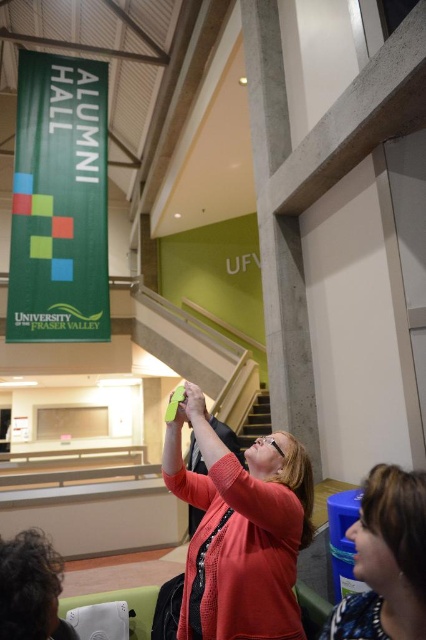
You are organizing a photo shoot for a university event and need to place a 1.2 meter wide banner between the matte pink sweater at center and the blue plastic water cooler at lower right. Based on their sizes, will the banner fit between them?

The matte pink sweater at center is wider than the blue plastic water cooler at lower right. However, the banner is 1.2 meters wide, so it depends on the actual space between them. The description only provides information about their widths, not the distance between the two objects. Therefore, we cannot determine if the banner will fit based on the given information.

You are planning to hang a small picture frame between the matte pink sweater at center and the blue plastic water cooler at lower right. Since the frame can only be placed at the same height as one of these objects, which object should you align the frame with to ensure it is visible above the other?

The matte pink sweater at center is taller than the blue plastic water cooler at lower right. To ensure the frame is visible above the other object, align it with the height of the matte pink sweater at center.